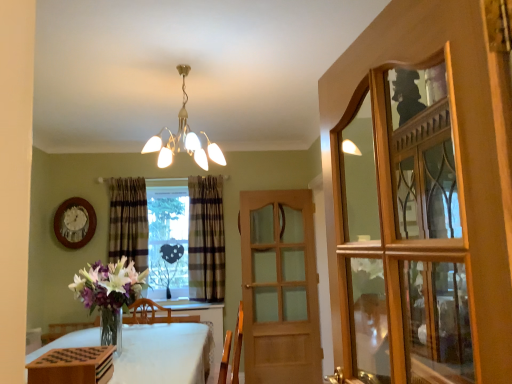
Locate an element on the screen. Image resolution: width=512 pixels, height=384 pixels. blank space situated above metallic chandelier at upper center (from a real-world perspective) is located at coordinates (182, 67).